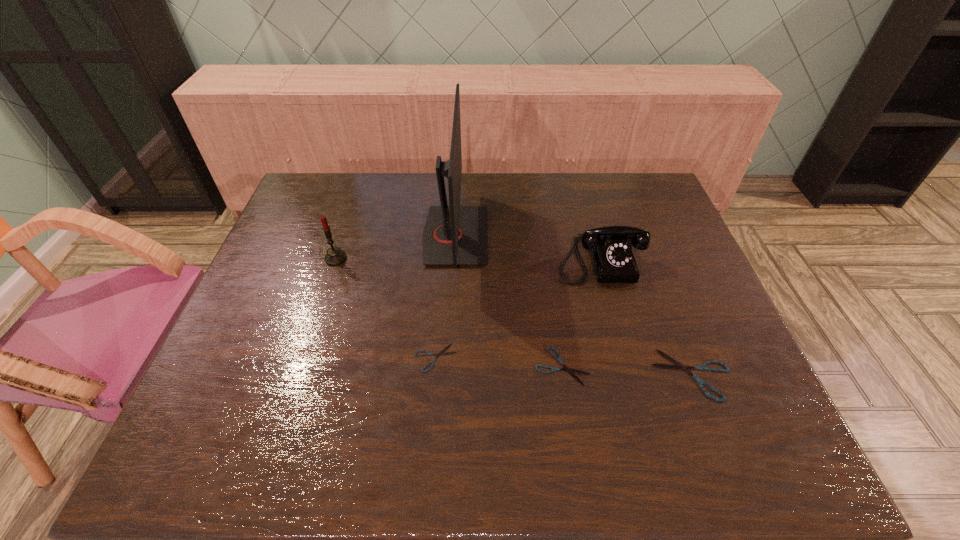
Identify the location of vacant space at the far edge. (423, 176).

Identify the location of vacant area at the near edge of the desktop. (382, 383).

The width and height of the screenshot is (960, 540). Identify the location of free spot at the left edge of the desktop. (253, 371).

I want to click on vacant space at the right edge of the desktop, so click(x=702, y=305).

Image resolution: width=960 pixels, height=540 pixels. Find the location of `vacant space at the far right corner of the desktop`. vacant space at the far right corner of the desktop is located at coordinates (619, 184).

The width and height of the screenshot is (960, 540). In order to click on unoccupied position between the candle and the shortest shears in this screenshot , I will do `click(386, 308)`.

Locate an element on the screen. This screenshot has height=540, width=960. unoccupied position between the leftmost shears and the fifth tallest object is located at coordinates (498, 362).

Locate an element on the screen. The width and height of the screenshot is (960, 540). vacant space in between the third shortest object and the second tallest object is located at coordinates (515, 316).

Where is `free space between the fourth tallest object and the second tallest object`? This screenshot has width=960, height=540. free space between the fourth tallest object and the second tallest object is located at coordinates (515, 316).

Identify the location of vacant area that lies between the leftmost shears and the fifth shortest object. Image resolution: width=960 pixels, height=540 pixels. (386, 308).